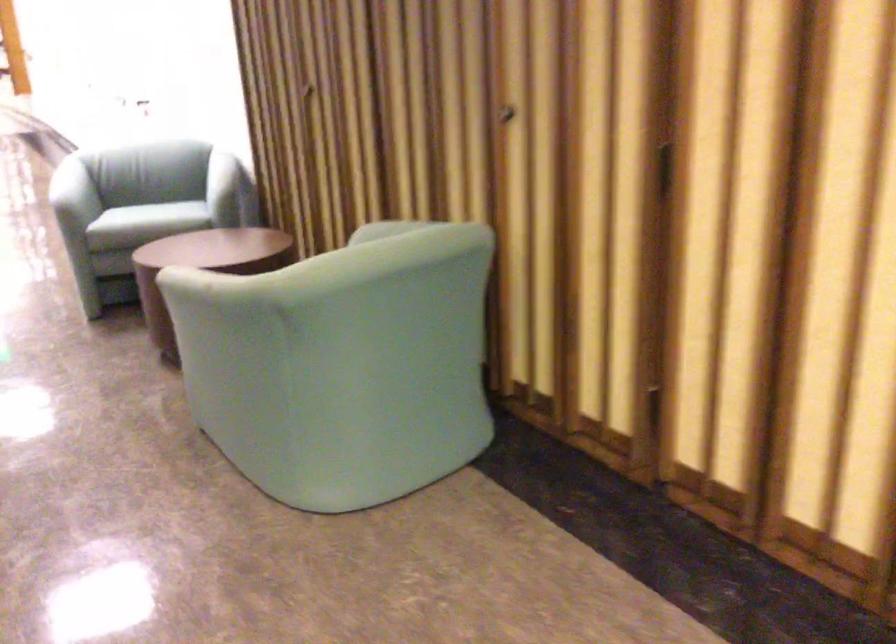
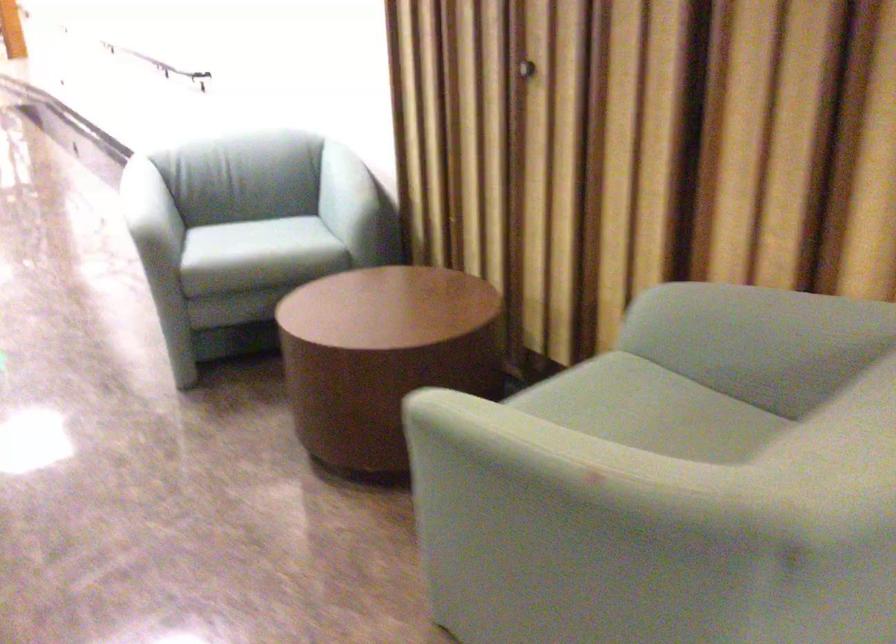
Find the pixel in the second image that matches pixel 303 79 in the first image.

(524, 70)